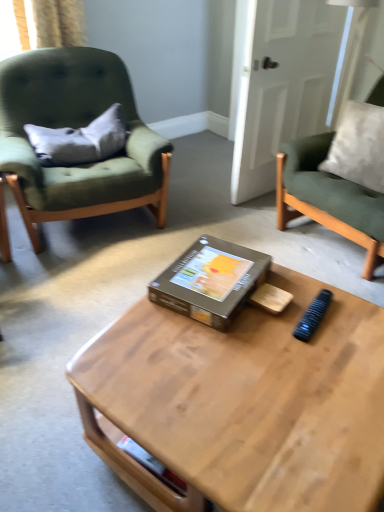
Where is `vacant region to the left of black plastic remote control at center`? vacant region to the left of black plastic remote control at center is located at coordinates (270, 318).